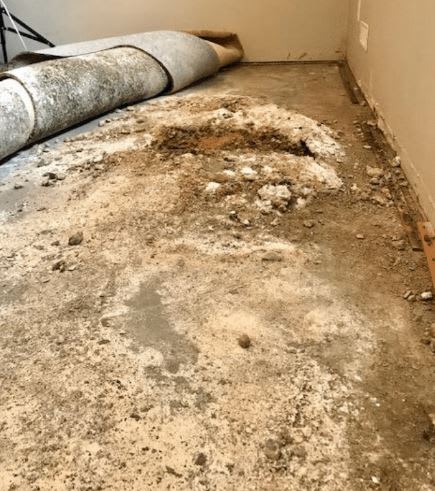
In order to click on brown floor in this screenshot , I will do `click(320, 96)`.